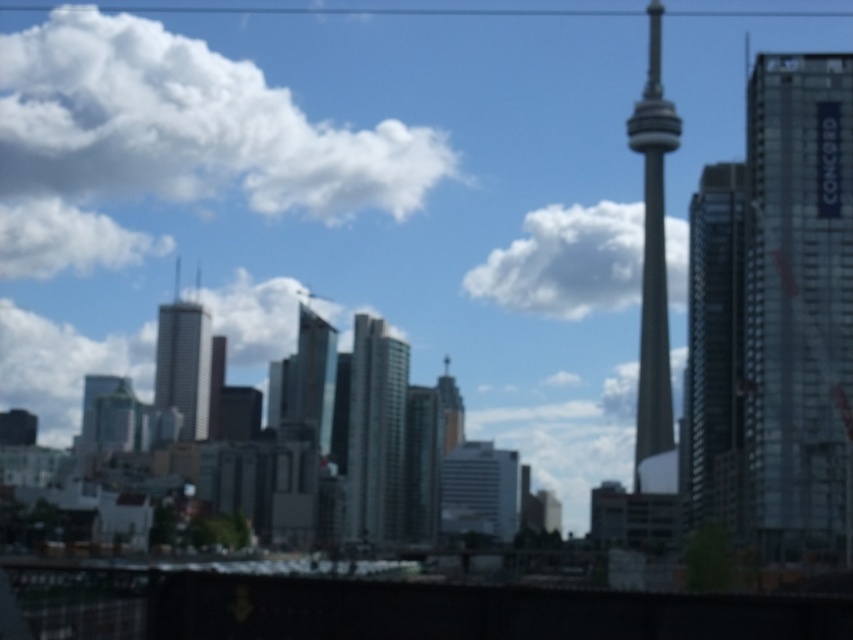
Question: Considering the relative positions of white fluffy cloud at upper left and white fluffy cloud at upper center in the image provided, where is white fluffy cloud at upper left located with respect to white fluffy cloud at upper center?

Choices:
 (A) above
 (B) below

Answer: (A)

Question: Which object is positioned closest to the smooth glass cn tower at center?

Choices:
 (A) white fluffy cloud at upper left
 (B) glassy reflective skyscraper at center
 (C) glassy silver skyscraper at right
 (D) smooth glass skyscraper at center

Answer: (D)

Question: Which point is closer to the camera taking this photo?

Choices:
 (A) (585, 252)
 (B) (695, 380)
 (C) (660, 378)
 (D) (236, 116)

Answer: (B)

Question: Among these points, which one is nearest to the camera?

Choices:
 (A) (239, 68)
 (B) (440, 384)
 (C) (718, 227)

Answer: (C)

Question: Can you confirm if silver glass skyscraper at center is positioned above glassy reflective skyscraper at center?

Choices:
 (A) yes
 (B) no

Answer: (A)

Question: Can you confirm if glassy silver skyscraper at right is positioned above glassy reflective skyscraper at right?

Choices:
 (A) no
 (B) yes

Answer: (B)